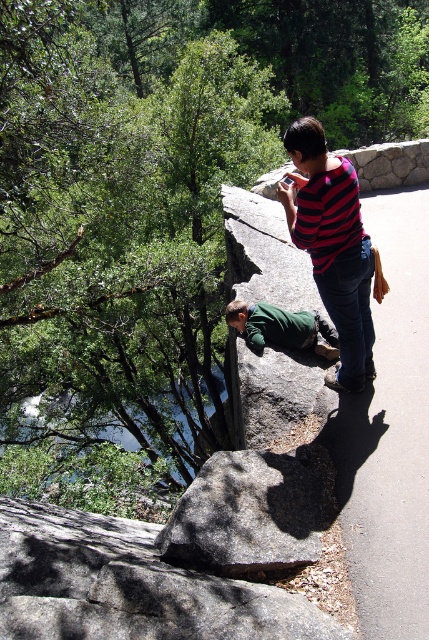
Question: Is the position of gray granite rock at center less distant than that of green cotton shirt at center?

Choices:
 (A) yes
 (B) no

Answer: (A)

Question: Is gray granite rock at center thinner than green fuzzy sweater at lower center?

Choices:
 (A) no
 (B) yes

Answer: (A)

Question: Which point is farther to the camera?

Choices:
 (A) green fuzzy sweater at lower center
 (B) green cotton shirt at center

Answer: (A)

Question: Does green cotton shirt at center appear under green fuzzy sweater at lower center?

Choices:
 (A) no
 (B) yes

Answer: (A)

Question: Which of the following is the closest to the observer?

Choices:
 (A) (262, 342)
 (B) (374, 372)

Answer: (B)

Question: Which point is closer to the camera?

Choices:
 (A) gray granite rock at center
 (B) green fuzzy sweater at lower center

Answer: (A)